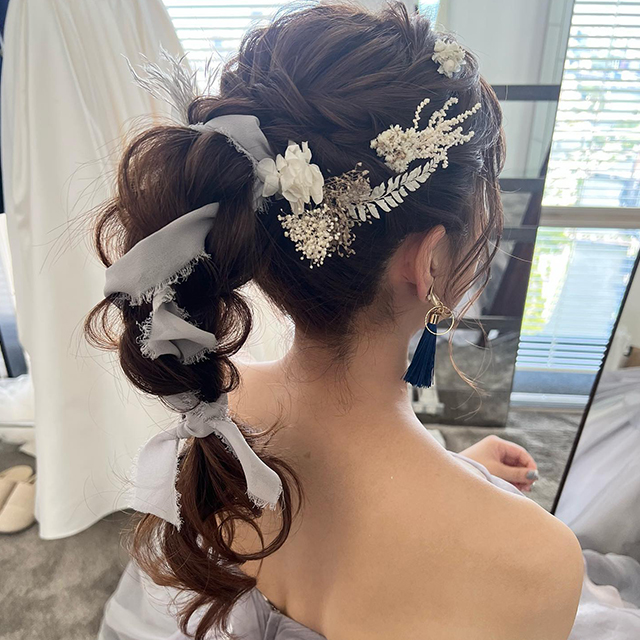
Find the location of `shoe`. shoe is located at coordinates (29, 498), (11, 476).